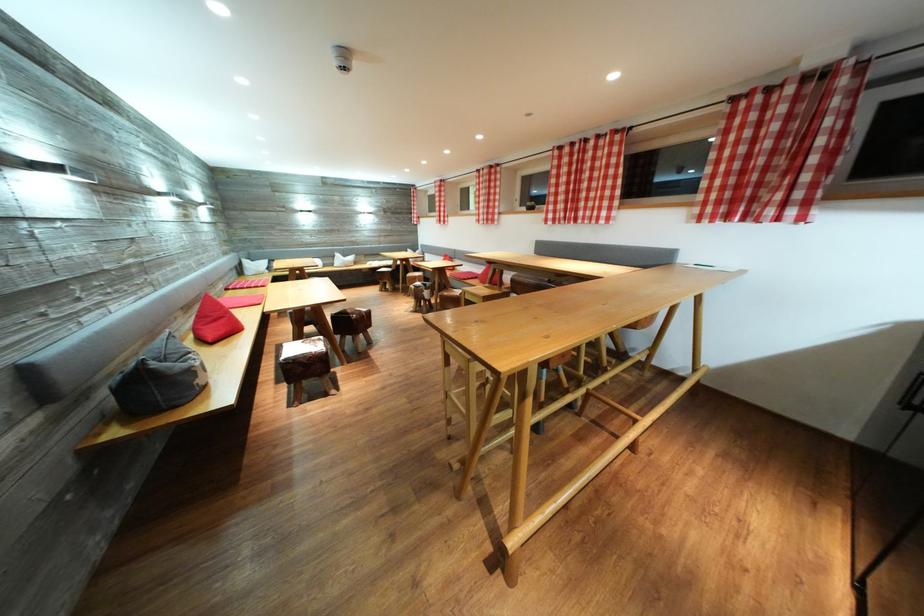
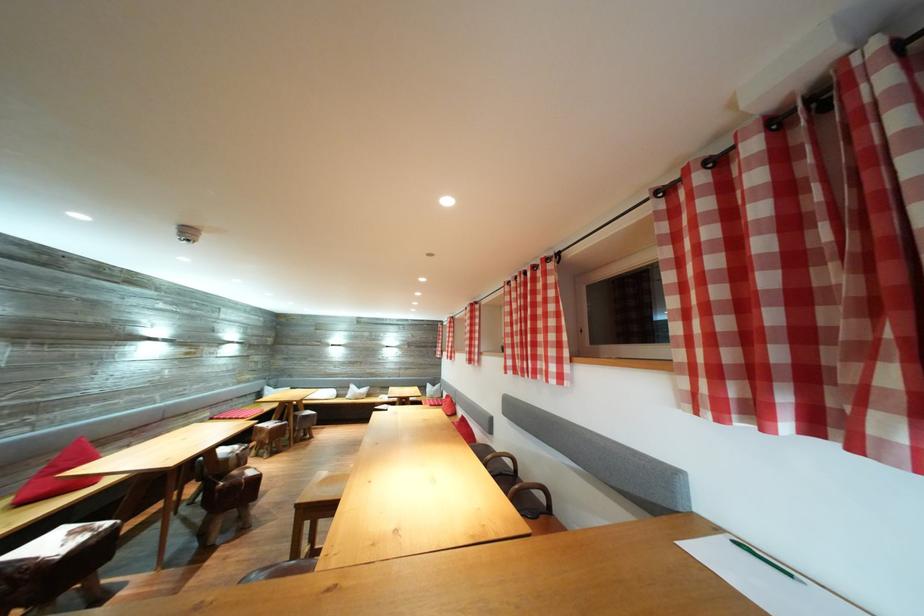
In the second image, find the point that corresponds to (227,338) in the first image.

(51, 496)